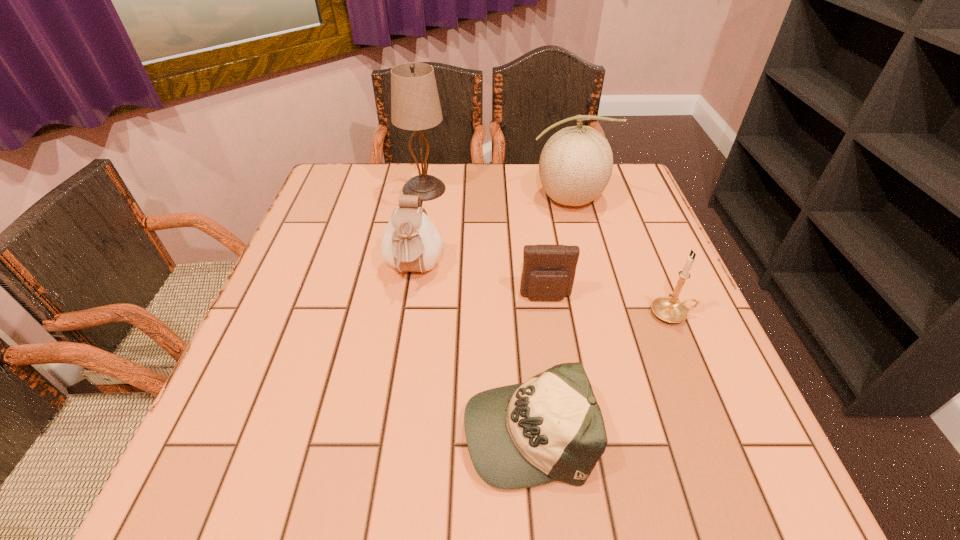
The image size is (960, 540). In order to click on vacant space located on the front-facing side of the taller pouch in this screenshot , I will do `click(398, 369)`.

Where is `vacant space located 0.070m with an open flap on the right pouch`? Image resolution: width=960 pixels, height=540 pixels. vacant space located 0.070m with an open flap on the right pouch is located at coordinates (551, 332).

Identify the location of blank space located 0.340m on the front-facing side of the shortest object. (254, 429).

Locate an element on the screen. free point located on the front-facing side of the shortest object is located at coordinates (396, 429).

Image resolution: width=960 pixels, height=540 pixels. In order to click on free space located 0.350m on the front-facing side of the shortest object in this screenshot , I will do [x=249, y=429].

Image resolution: width=960 pixels, height=540 pixels. I want to click on lampshade that is at the far edge, so click(415, 105).

At what (x,y) coordinates should I click in order to perform the action: click on cantaloup at the far edge. Please return your answer as a coordinate pair (x, y). The height and width of the screenshot is (540, 960). Looking at the image, I should click on (576, 163).

The height and width of the screenshot is (540, 960). Identify the location of object that is at the near edge. (550, 428).

Identify the location of cantaloup at the right edge. (576, 163).

This screenshot has width=960, height=540. Find the location of `candle holder that is at the right edge`. candle holder that is at the right edge is located at coordinates (669, 309).